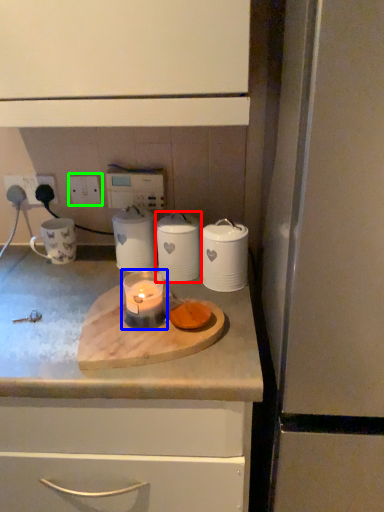
Question: Based on their relative distances, which object is farther from kitchen appliance (highlighted by a red box)? Choose from candle holder (highlighted by a blue box) and electric outlet (highlighted by a green box).

Choices:
 (A) candle holder
 (B) electric outlet

Answer: (B)